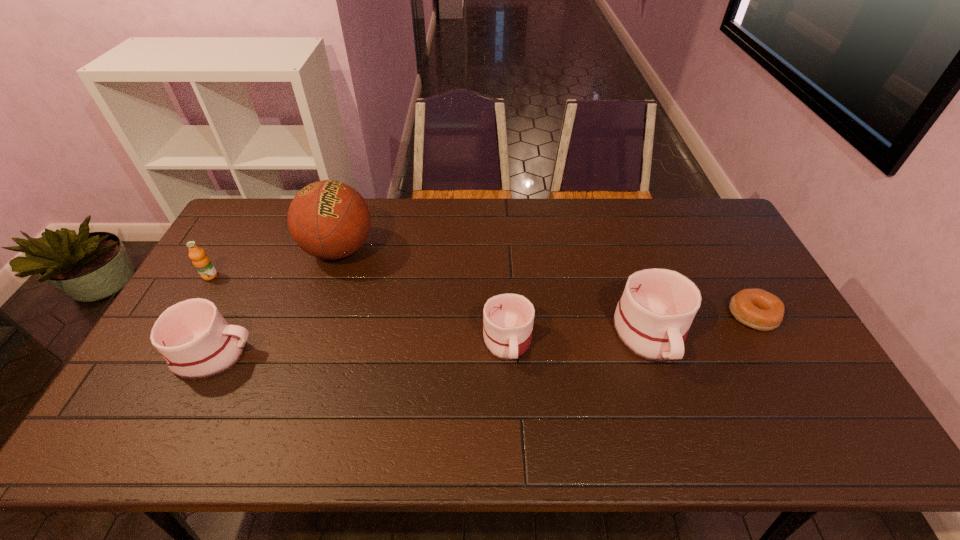
At what (x,y) coordinates should I click in order to perform the action: click on vacant space located on the side with the handle of the second shortest object. Please return your answer as a coordinate pair (x, y). Looking at the image, I should click on (511, 408).

I want to click on free spot located 0.050m on the side with the handle of the rightmost mug, so click(x=668, y=392).

The width and height of the screenshot is (960, 540). Find the location of `vacant position located on the right of the basketball`. vacant position located on the right of the basketball is located at coordinates (412, 249).

Where is `free space located 0.290m on the label of the orange juice`? Image resolution: width=960 pixels, height=540 pixels. free space located 0.290m on the label of the orange juice is located at coordinates (160, 360).

Where is `vacant region located 0.290m on the back of the rightmost object`? The height and width of the screenshot is (540, 960). vacant region located 0.290m on the back of the rightmost object is located at coordinates (708, 235).

Where is `object at the far edge`? This screenshot has height=540, width=960. object at the far edge is located at coordinates (328, 219).

Where is `object present at the near edge`? This screenshot has height=540, width=960. object present at the near edge is located at coordinates (195, 340).

Where is `mug present at the left edge`? The height and width of the screenshot is (540, 960). mug present at the left edge is located at coordinates (195, 340).

What are the coordinates of `orange juice at the left edge` in the screenshot? It's located at (202, 263).

Image resolution: width=960 pixels, height=540 pixels. I want to click on object located at the right edge, so click(758, 309).